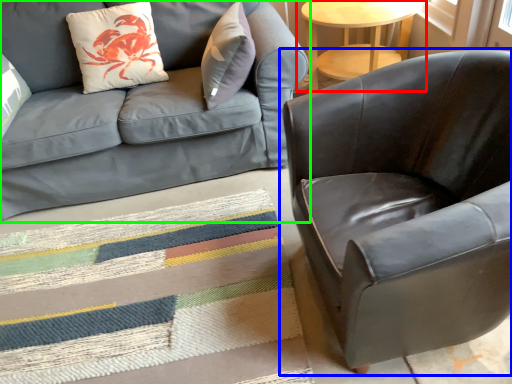
Question: Which is nearer to the table (highlighted by a red box)? chair (highlighted by a blue box) or studio couch (highlighted by a green box).

Choices:
 (A) chair
 (B) studio couch

Answer: (B)